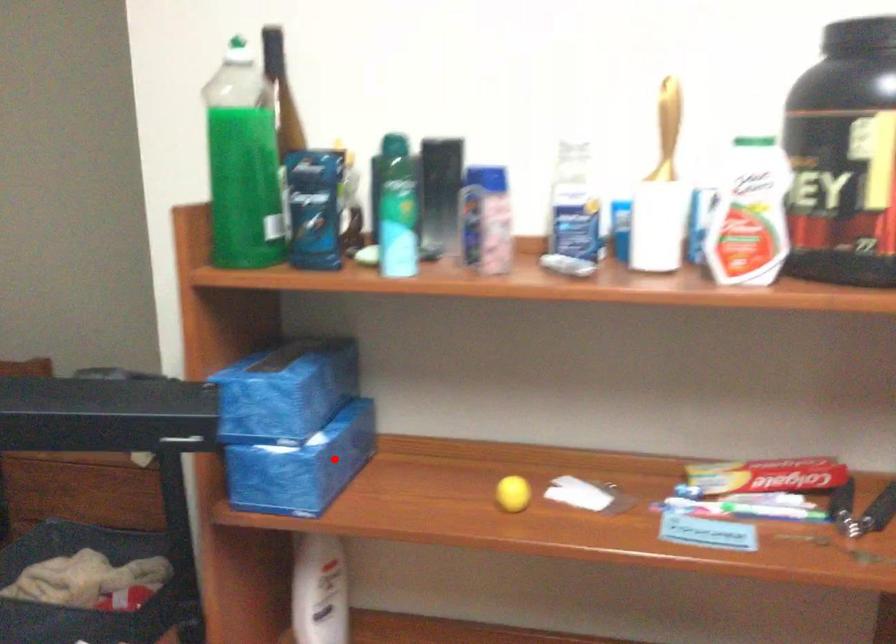
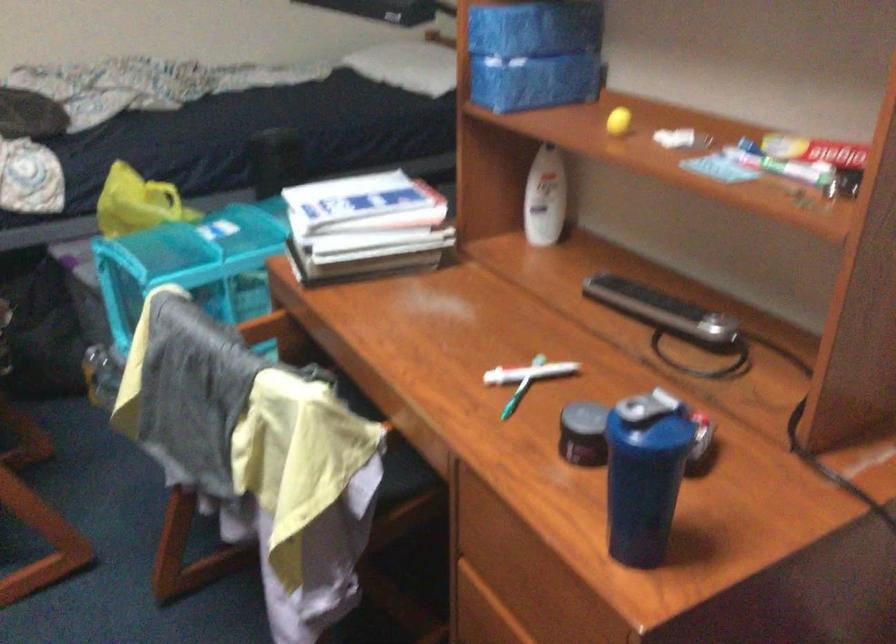
Find the pixel in the second image that matches the highlighted location in the first image.

(533, 82)